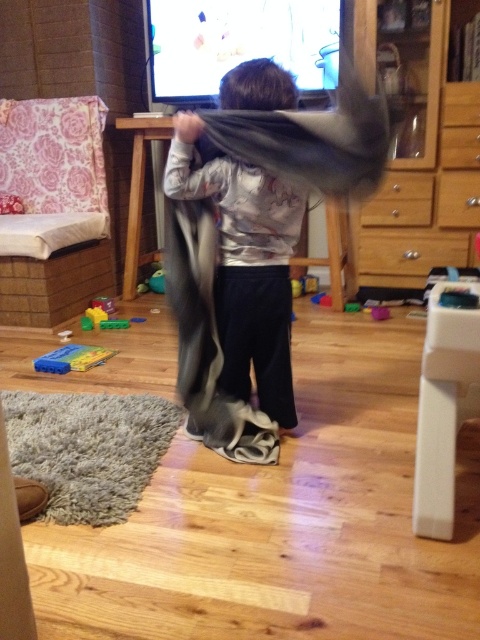
You are standing in the living room and want to reach the point marked as point (399, 276). If you take a step forward, will you be closer to or farther from that point?

The point (399, 276) is 3.16 meters away from the viewer. Taking a step forward would decrease the distance, so you would be closer to the point (399, 276).